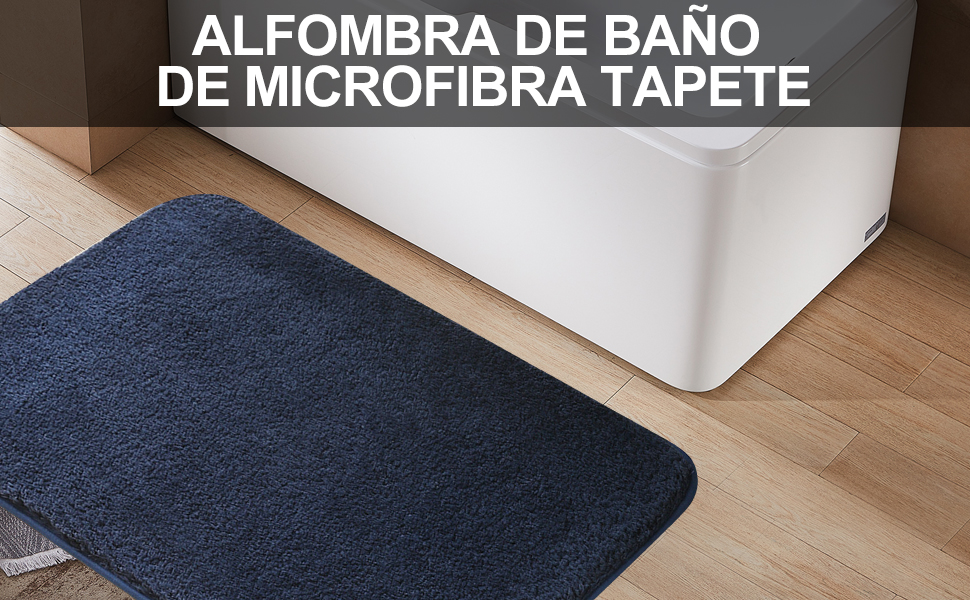
This screenshot has height=600, width=970. What are the coordinates of `wall` in the screenshot? It's located at (925, 161), (55, 138), (101, 139).